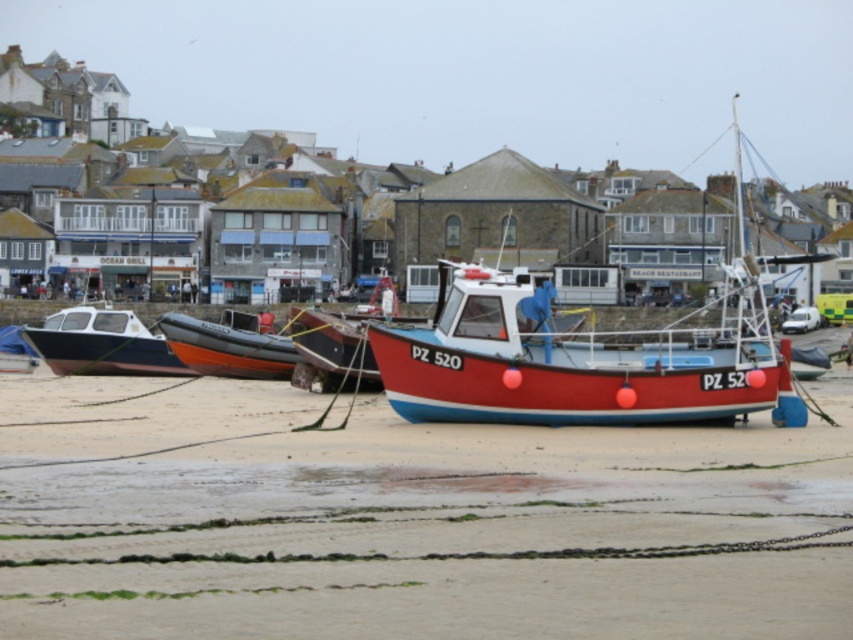
Does red matte boat at center appear under orange rubber dinghy at center?

No, red matte boat at center is not below orange rubber dinghy at center.

Who is positioned more to the right, red matte boat at center or orange rubber dinghy at center?

From the viewer's perspective, red matte boat at center appears more on the right side.

Describe the element at coordinates (573, 362) in the screenshot. I see `red matte boat at center` at that location.

Identify the location of red matte boat at center. (573, 362).

How far apart are smooth sand at lower center and matte white boat at left?

smooth sand at lower center and matte white boat at left are 34.11 meters apart.

Who is shorter, smooth sand at lower center or matte white boat at left?

smooth sand at lower center is shorter.

Is point (593, 580) positioned in front of point (105, 305)?

Yes, it is.

Identify the location of smooth sand at lower center. (408, 520).

Is smooth sand at lower center closer to camera compared to red matte boat at center?

Yes, it is in front of red matte boat at center.

In the scene shown: Does smooth sand at lower center have a greater height compared to red matte boat at center?

Incorrect, smooth sand at lower center's height is not larger of red matte boat at center's.

Which is behind, point (525, 500) or point (621, 385)?

Positioned behind is point (621, 385).

Find the location of a particular element. This screenshot has height=640, width=853. smooth sand at lower center is located at coordinates (408, 520).